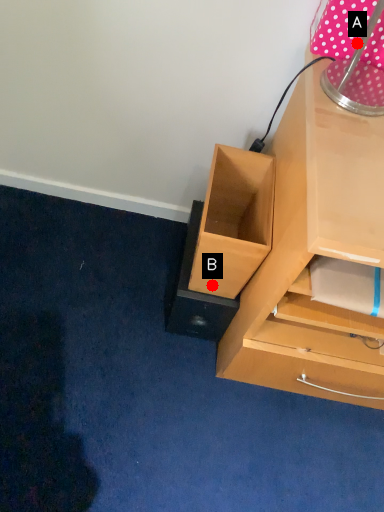
Question: Two points are circled on the image, labeled by A and B beside each circle. Which point is farther from the camera taking this photo?

Choices:
 (A) A is further
 (B) B is further

Answer: (B)